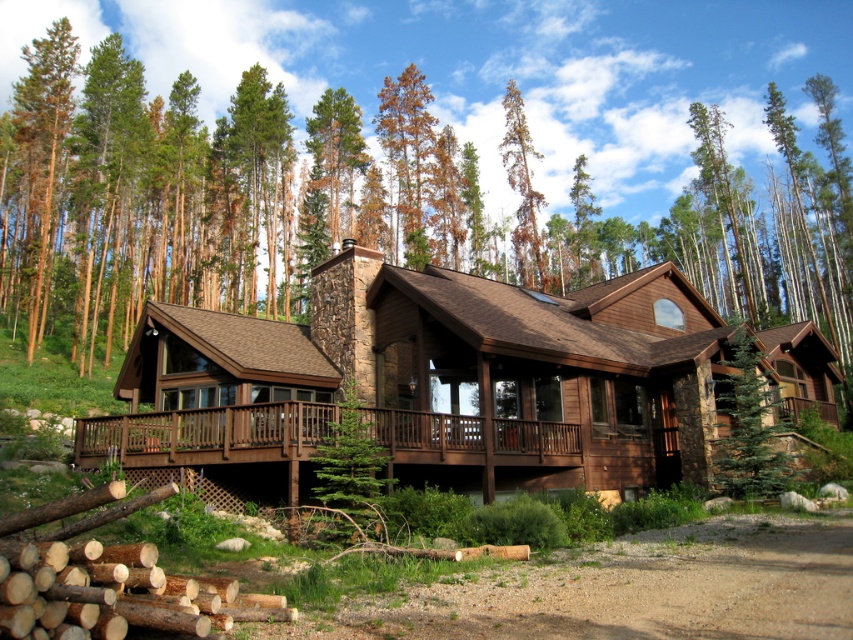
Question: Where is green wood tree at center located in relation to brown wood cabin at center in the image?

Choices:
 (A) right
 (B) left

Answer: (B)

Question: Among these objects, which one is farthest from the camera?

Choices:
 (A) brown wood porch at lower center
 (B) brown wood cabin at center
 (C) natural brown wood at lower left
 (D) green wood tree at center

Answer: (D)

Question: In this image, where is green wood tree at center located relative to brown bark tree at upper center?

Choices:
 (A) left
 (B) right

Answer: (A)

Question: Which object appears farthest from the camera in this image?

Choices:
 (A) brown wood tree at left
 (B) brown wood porch at lower center
 (C) green wood tree at center
 (D) natural brown wood at lower left

Answer: (A)

Question: Is brown wood porch at lower center wider than natural brown wood at lower left?

Choices:
 (A) no
 (B) yes

Answer: (B)

Question: Which point appears farthest from the camera in this image?

Choices:
 (A) (x=67, y=97)
 (B) (x=183, y=624)
 (C) (x=376, y=189)

Answer: (C)